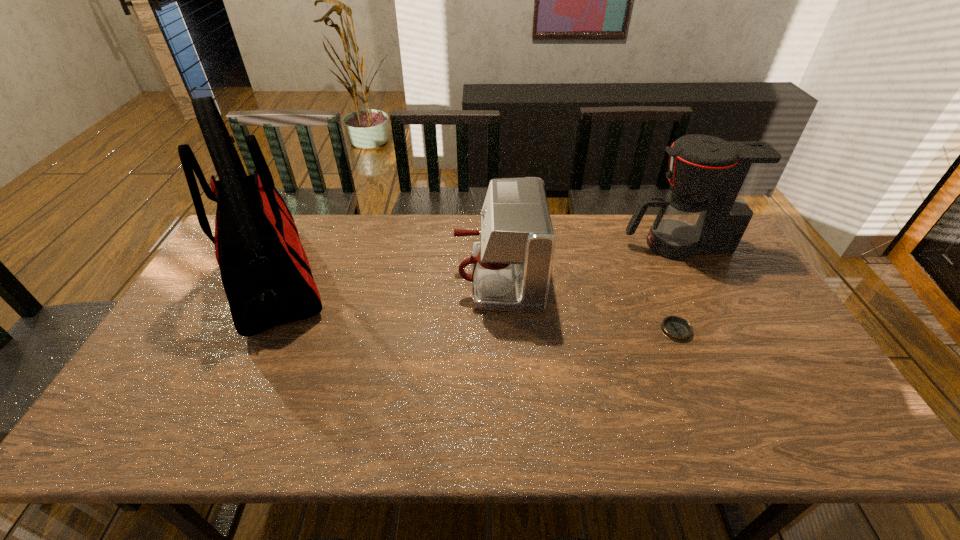
Identify the location of free spot that satisfies the following two spatial constraints: 1. on the back side of the shortest object; 2. on the front of the second shortest object near the spout. This screenshot has width=960, height=540. (654, 278).

Where is `vacant area in the image that satisfies the following two spatial constraints: 1. on the back side of the shortest object; 2. on the front of the left coffee maker near the spout`? This screenshot has height=540, width=960. vacant area in the image that satisfies the following two spatial constraints: 1. on the back side of the shortest object; 2. on the front of the left coffee maker near the spout is located at coordinates (654, 278).